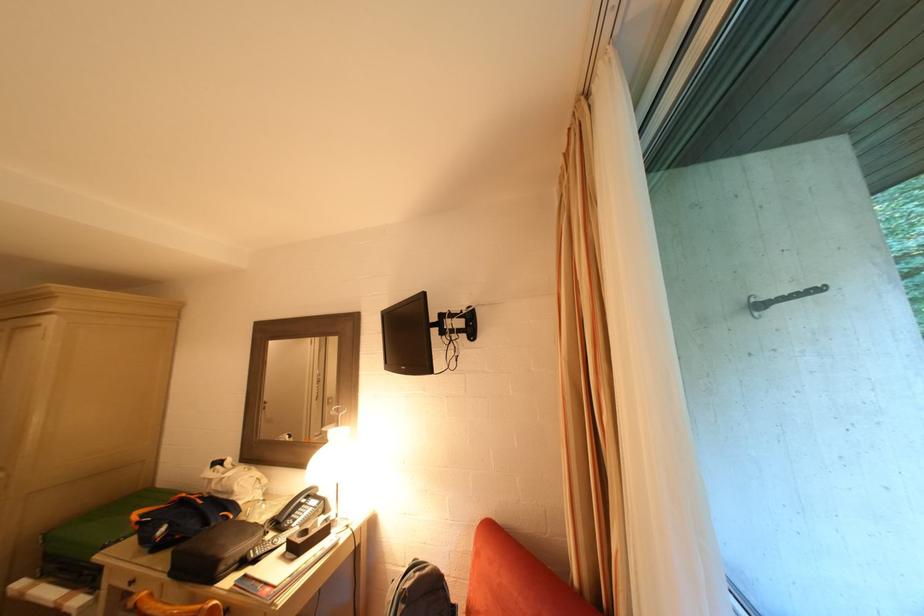
The height and width of the screenshot is (616, 924). What do you see at coordinates (301, 512) in the screenshot? I see `a telephone buttons` at bounding box center [301, 512].